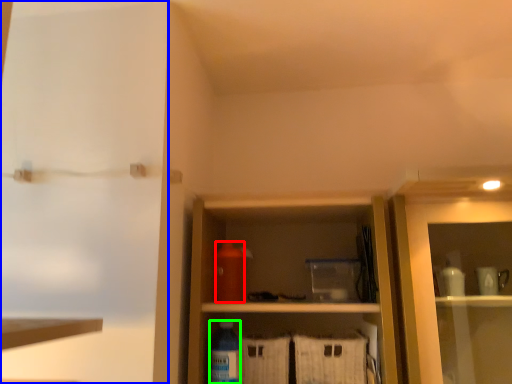
Question: Considering the real-world distances, which object is farthest from bottle (highlighted by a red box)? screen door (highlighted by a blue box) or bottle (highlighted by a green box)?

Choices:
 (A) screen door
 (B) bottle

Answer: (A)